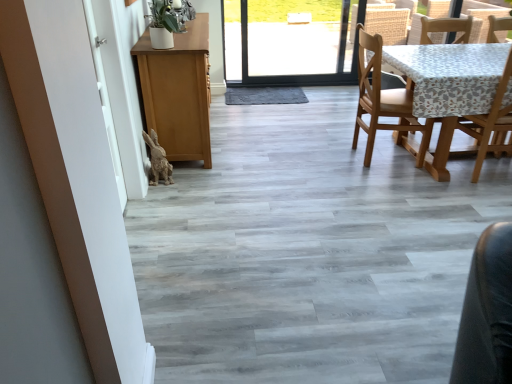
What is the approximate height of white matte screen door at left?

4.18 feet.

I want to click on wooden chair at right, marked as the 1th chair in a left-to-right arrangement, so click(384, 101).

Considering the relative sizes of wooden chair at right, acting as the second chair starting from the left, and wooden chair at right in the image provided, is wooden chair at right, acting as the second chair starting from the left, wider than wooden chair at right?

Correct, the width of wooden chair at right, acting as the second chair starting from the left, exceeds that of wooden chair at right.

Is point (501, 152) behind point (471, 12)?

No.

Is wooden chair at right, which is counted as the first chair, starting from the right, beside wooden chair at right?

No, wooden chair at right, which is counted as the first chair, starting from the right, is not in contact with wooden chair at right.

Is wooden chair at right, which is counted as the first chair, starting from the right, facing away from wooden chair at right?

No, wooden chair at right, which is counted as the first chair, starting from the right,'s orientation is not away from wooden chair at right.

Is wooden chair at right, which is counted as the first chair, starting from the right, completely or partially inside white matte screen door at left?

No, wooden chair at right, which is counted as the first chair, starting from the right, is not inside white matte screen door at left.

From a real-world perspective, is white matte screen door at left positioned above or below wooden chair at right, acting as the second chair starting from the left?

white matte screen door at left is above wooden chair at right, acting as the second chair starting from the left.

Considering the positions of objects white matte screen door at left and wooden chair at right, acting as the second chair starting from the left, in the image provided, who is behind, white matte screen door at left or wooden chair at right, acting as the second chair starting from the left,?

wooden chair at right, acting as the second chair starting from the left, is further from the camera.

Does point (116, 116) lie in front of point (489, 132)?

Yes.

From a real-world perspective, is wooden chair at right physically located above or below wooden chair at right, marked as the 1th chair in a left-to-right arrangement?

In terms of real-world spatial position, wooden chair at right is above wooden chair at right, marked as the 1th chair in a left-to-right arrangement.

Which is behind, point (486, 4) or point (367, 105)?

The point (486, 4) is farther from the camera.

Does wooden chair at right appear on the left side of wooden chair at right, marked as the 1th chair in a left-to-right arrangement?

In fact, wooden chair at right is to the right of wooden chair at right, marked as the 1th chair in a left-to-right arrangement.

Is wooden chair at right taller than wooden chair at right, marked as the 2th chair in a right-to-left arrangement?

No.

Consider the image. Which of these two, wooden chair at right, acting as the second chair starting from the left, or wooden chair at right, marked as the 1th chair in a left-to-right arrangement, is thinner?

Thinner between the two is wooden chair at right, acting as the second chair starting from the left.

From a real-world perspective, is wooden chair at right, which is counted as the first chair, starting from the right, above or below wooden chair at right, marked as the 1th chair in a left-to-right arrangement?

In terms of real-world spatial position, wooden chair at right, which is counted as the first chair, starting from the right, is above wooden chair at right, marked as the 1th chair in a left-to-right arrangement.

From the picture: How different are the orientations of wooden chair at right, acting as the second chair starting from the left, and wooden chair at right, marked as the 1th chair in a left-to-right arrangement, in degrees?

wooden chair at right, acting as the second chair starting from the left, and wooden chair at right, marked as the 1th chair in a left-to-right arrangement, are facing 90 degrees away from each other.

Could you measure the distance between wooden chair at right and wooden chair at right, acting as the second chair starting from the left?

They are 37.84 inches apart.

How different are the orientations of wooden chair at right and wooden chair at right, acting as the second chair starting from the left, in degrees?

There is a 89-degree angle between the facing directions of wooden chair at right and wooden chair at right, acting as the second chair starting from the left.

Is wooden chair at right in contact with wooden chair at right, acting as the second chair starting from the left?

There is a gap between wooden chair at right and wooden chair at right, acting as the second chair starting from the left.

From the image's perspective, is wooden chair at right located above wooden chair at right, which is counted as the first chair, starting from the right?

Yes.

Is wooden chair at right beside white matte screen door at left?

No, wooden chair at right is not beside white matte screen door at left.

At what (x,y) coordinates should I click in order to perform the action: click on armchair on the right of the white matte screen door at left. Please return your answer as a coordinate pair (x, y). This screenshot has width=512, height=384. Looking at the image, I should click on (486, 19).

Is wooden chair at right outside of white matte screen door at left?

wooden chair at right is positioned outside white matte screen door at left.

Which of these two, wooden chair at right, which is counted as the first chair, starting from the right, or white matte screen door at left, stands taller?

Standing taller between the two is white matte screen door at left.

How different are the orientations of wooden chair at right, which is counted as the first chair, starting from the right, and white matte screen door at left in degrees?

89 degrees.

Is wooden chair at right, acting as the second chair starting from the left, not near white matte screen door at left?

Yes.

From a real-world perspective, which chair is the 1st one underneath the wooden chair at right? Please provide its 2D coordinates.

[(490, 124)]

Where is `screen door below the wooden chair at right, acting as the second chair starting from the left (from the image's perspective)`? The width and height of the screenshot is (512, 384). screen door below the wooden chair at right, acting as the second chair starting from the left (from the image's perspective) is located at coordinates (119, 92).

Looking at the image, which one is located closer to wooden chair at right, marked as the 1th chair in a left-to-right arrangement, wooden chair at right or wooden chair at right, acting as the second chair starting from the left?

wooden chair at right, acting as the second chair starting from the left, lies closer to wooden chair at right, marked as the 1th chair in a left-to-right arrangement, than the other object.

Which object lies further to the anchor point wooden chair at right, wooden chair at right, marked as the 2th chair in a right-to-left arrangement, or wooden chair at right, which is counted as the first chair, starting from the right?

wooden chair at right, marked as the 2th chair in a right-to-left arrangement, lies further to wooden chair at right than the other object.

Based on their spatial positions, is white matte screen door at left or wooden chair at right, marked as the 1th chair in a left-to-right arrangement, further from wooden chair at right, acting as the second chair starting from the left?

white matte screen door at left is positioned further to the anchor wooden chair at right, acting as the second chair starting from the left.

Which object lies nearer to the anchor point white matte screen door at left, wooden chair at right, marked as the 2th chair in a right-to-left arrangement, or wooden chair at right?

Based on the image, wooden chair at right, marked as the 2th chair in a right-to-left arrangement, appears to be nearer to white matte screen door at left.

From the picture: Estimate the real-world distances between objects in this image. Which object is further from wooden chair at right, wooden chair at right, which is counted as the first chair, starting from the right, or wooden chair at right, marked as the 2th chair in a right-to-left arrangement?

Based on the image, wooden chair at right, marked as the 2th chair in a right-to-left arrangement, appears to be further to wooden chair at right.

From the image, which object appears to be farther from wooden chair at right, which is counted as the first chair, starting from the right, wooden chair at right or wooden chair at right, marked as the 1th chair in a left-to-right arrangement?

Based on the image, wooden chair at right appears to be further to wooden chair at right, which is counted as the first chair, starting from the right.

Looking at the image, which one is located closer to wooden chair at right, marked as the 1th chair in a left-to-right arrangement, wooden chair at right or white matte screen door at left?

wooden chair at right is closer to wooden chair at right, marked as the 1th chair in a left-to-right arrangement.

Estimate the real-world distances between objects in this image. Which object is further from wooden chair at right, marked as the 1th chair in a left-to-right arrangement, white matte screen door at left or wooden chair at right, which is counted as the first chair, starting from the right?

white matte screen door at left lies further to wooden chair at right, marked as the 1th chair in a left-to-right arrangement, than the other object.

The image size is (512, 384). Identify the location of chair located between wooden chair at right, marked as the 1th chair in a left-to-right arrangement, and wooden chair at right in the left-right direction. (490, 124).

You are a GUI agent. You are given a task and a screenshot of the screen. Output one action in this format:
    pyautogui.click(x=<x>, y=<y>)
    Task: Click on the chair located between white matte screen door at left and wooden chair at right, which is counted as the first chair, starting from the right, in the left-right direction
    
    Given the screenshot: What is the action you would take?
    pyautogui.click(x=384, y=101)